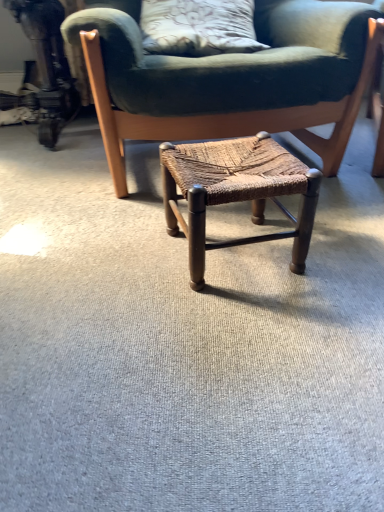
Question: Does woven wood stool at center have a lesser height compared to brown woven stool at center?

Choices:
 (A) no
 (B) yes

Answer: (B)

Question: Is woven wood stool at center not inside brown woven stool at center?

Choices:
 (A) yes
 (B) no

Answer: (A)

Question: Is woven wood stool at center bigger than brown woven stool at center?

Choices:
 (A) no
 (B) yes

Answer: (A)

Question: From the image's perspective, is woven wood stool at center over brown woven stool at center?

Choices:
 (A) yes
 (B) no

Answer: (B)

Question: Are woven wood stool at center and brown woven stool at center far apart?

Choices:
 (A) yes
 (B) no

Answer: (B)

Question: Does woven wood stool at center have a smaller size compared to brown woven stool at center?

Choices:
 (A) no
 (B) yes

Answer: (B)

Question: Is woven wood stool at center surrounded by brown woven stool at center?

Choices:
 (A) yes
 (B) no

Answer: (B)

Question: Is brown woven stool at center facing towards woven wood stool at center?

Choices:
 (A) no
 (B) yes

Answer: (B)

Question: From a real-world perspective, is brown woven stool at center over woven wood stool at center?

Choices:
 (A) no
 (B) yes

Answer: (B)

Question: Considering the relative positions of brown woven stool at center and woven wood stool at center in the image provided, is brown woven stool at center to the right of woven wood stool at center from the viewer's perspective?

Choices:
 (A) yes
 (B) no

Answer: (B)

Question: Would you say brown woven stool at center is a long distance from woven wood stool at center?

Choices:
 (A) no
 (B) yes

Answer: (A)

Question: Does brown woven stool at center have a larger size compared to woven wood stool at center?

Choices:
 (A) no
 (B) yes

Answer: (B)

Question: From a real-world perspective, relative to woven wood stool at center, is brown woven stool at center vertically above or below?

Choices:
 (A) above
 (B) below

Answer: (A)